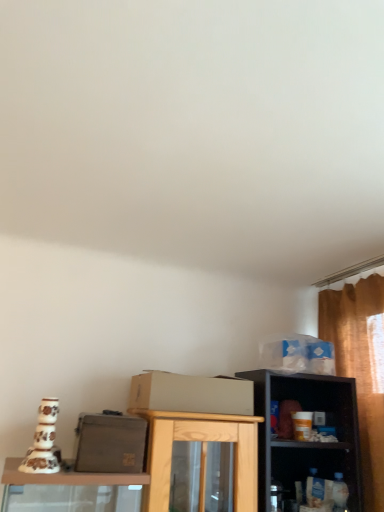
Question: Does matte gray box at center, arranged as the 2th box when viewed from the top, have a greater width compared to beige cardboard box at center?

Choices:
 (A) no
 (B) yes

Answer: (A)

Question: Considering the relative positions of matte gray box at center, arranged as the 2th box when viewed from the top, and beige cardboard box at center in the image provided, is matte gray box at center, arranged as the 2th box when viewed from the top, to the left of beige cardboard box at center from the viewer's perspective?

Choices:
 (A) yes
 (B) no

Answer: (A)

Question: Could you tell me if matte gray box at center, the 2th box when ordered from right to left, is facing beige cardboard box at center?

Choices:
 (A) yes
 (B) no

Answer: (B)

Question: Considering the relative sizes of matte gray box at center, the first box from the bottom, and beige cardboard box at center in the image provided, is matte gray box at center, the first box from the bottom, smaller than beige cardboard box at center?

Choices:
 (A) yes
 (B) no

Answer: (A)

Question: Is matte gray box at center, which is the 1th box from left to right, far from beige cardboard box at center?

Choices:
 (A) yes
 (B) no

Answer: (B)

Question: In the image, is blue plastic bag at upper right, the 2th box in the front-to-back sequence, positioned in front of or behind white plastic shelf at lower right?

Choices:
 (A) behind
 (B) front

Answer: (A)

Question: Is point (259, 345) closer or farther from the camera than point (326, 452)?

Choices:
 (A) closer
 (B) farther

Answer: (B)

Question: Visually, is blue plastic bag at upper right, the 2th box in the front-to-back sequence, positioned to the left or to the right of white plastic shelf at lower right?

Choices:
 (A) left
 (B) right

Answer: (A)

Question: From a real-world perspective, is blue plastic bag at upper right, placed as the 1th box when sorted from top to bottom, positioned above or below white plastic shelf at lower right?

Choices:
 (A) below
 (B) above

Answer: (B)

Question: Is point (120, 472) positioned closer to the camera than point (140, 375)?

Choices:
 (A) closer
 (B) farther

Answer: (A)

Question: Is matte gray box at center, acting as the first box starting from the front, wider or thinner than beige cardboard box at center?

Choices:
 (A) thin
 (B) wide

Answer: (A)

Question: Is matte gray box at center, which is the 1th box from left to right, bigger or smaller than beige cardboard box at center?

Choices:
 (A) small
 (B) big

Answer: (A)

Question: Is matte gray box at center, the 2th box when ordered from right to left, spatially inside beige cardboard box at center, or outside of it?

Choices:
 (A) inside
 (B) outside

Answer: (B)

Question: Does point pyautogui.click(x=294, y=470) appear closer or farther from the camera than point pyautogui.click(x=188, y=407)?

Choices:
 (A) closer
 (B) farther

Answer: (B)

Question: Considering their positions, is white plastic shelf at lower right located in front of or behind beige cardboard box at center?

Choices:
 (A) behind
 (B) front

Answer: (A)